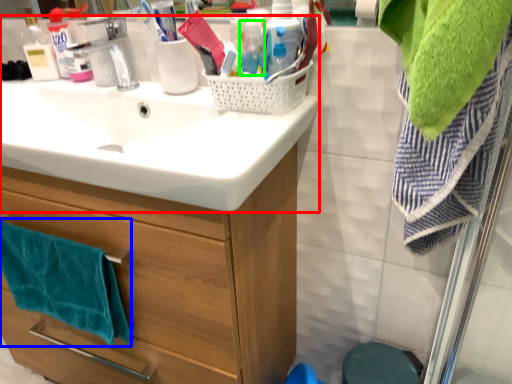
Question: Estimate the real-world distances between objects in this image. Which object is farther from sink (highlighted by a red box), bath towel (highlighted by a blue box) or bottle (highlighted by a green box)?

Choices:
 (A) bath towel
 (B) bottle

Answer: (B)